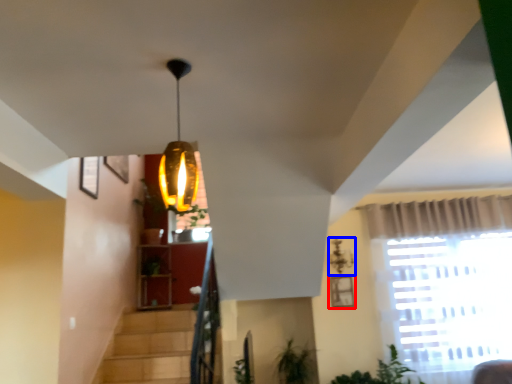
Question: Which object is further to the camera taking this photo, picture frame (highlighted by a red box) or lamp (highlighted by a blue box)?

Choices:
 (A) picture frame
 (B) lamp

Answer: (A)